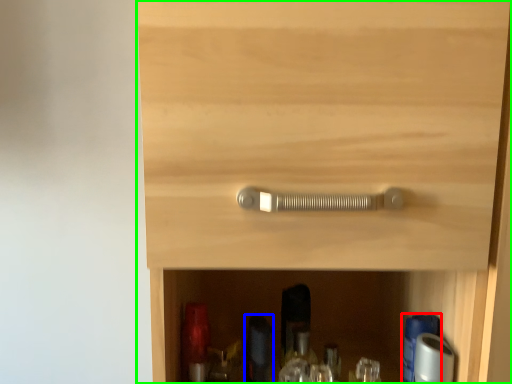
Question: Which object is positioned closest to bottle (highlighted by a red box)? Select from bottle (highlighted by a blue box) and cupboard (highlighted by a green box).

Choices:
 (A) bottle
 (B) cupboard

Answer: (A)